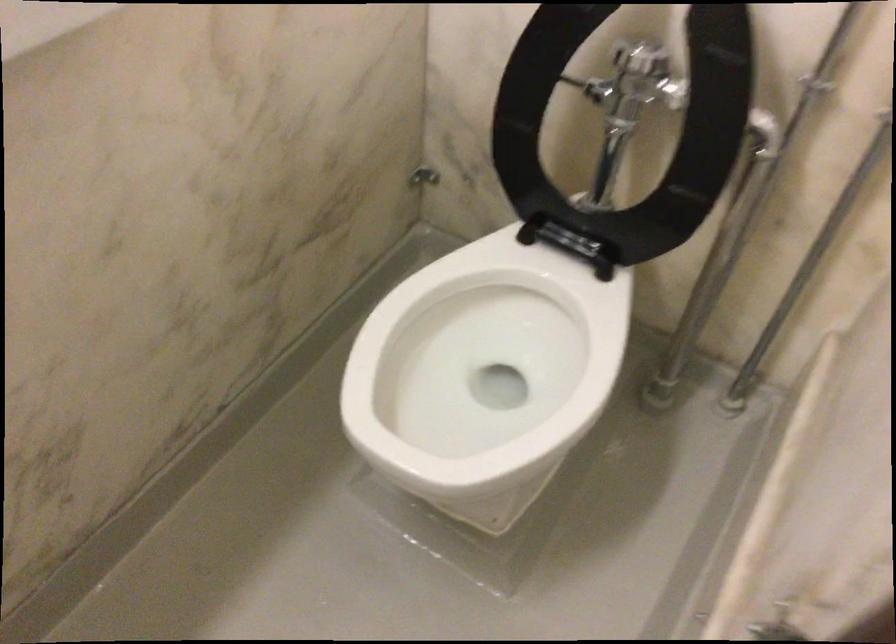
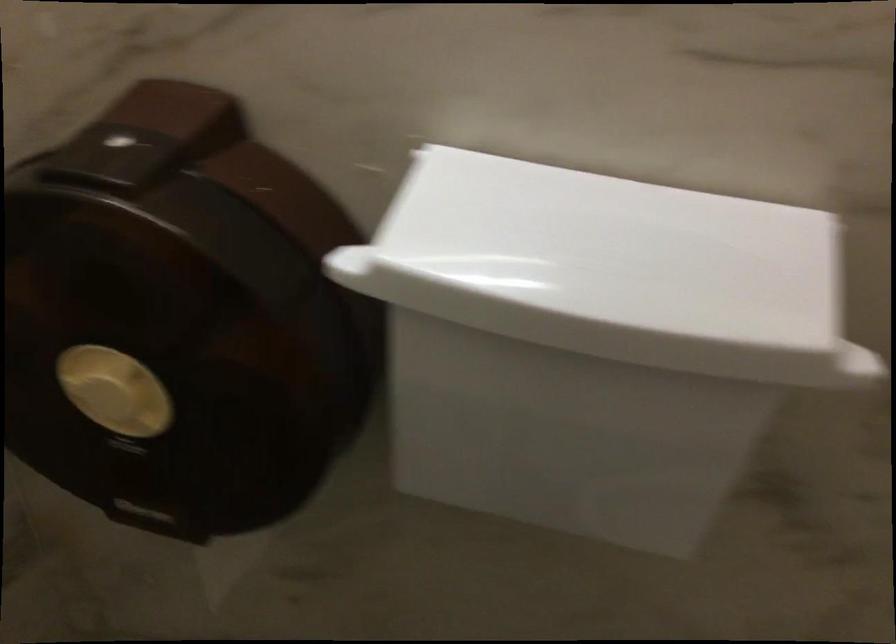
Question: How did the camera likely rotate?

Choices:
 (A) Left
 (B) Right
 (C) Up
 (D) Down

Answer: (A)